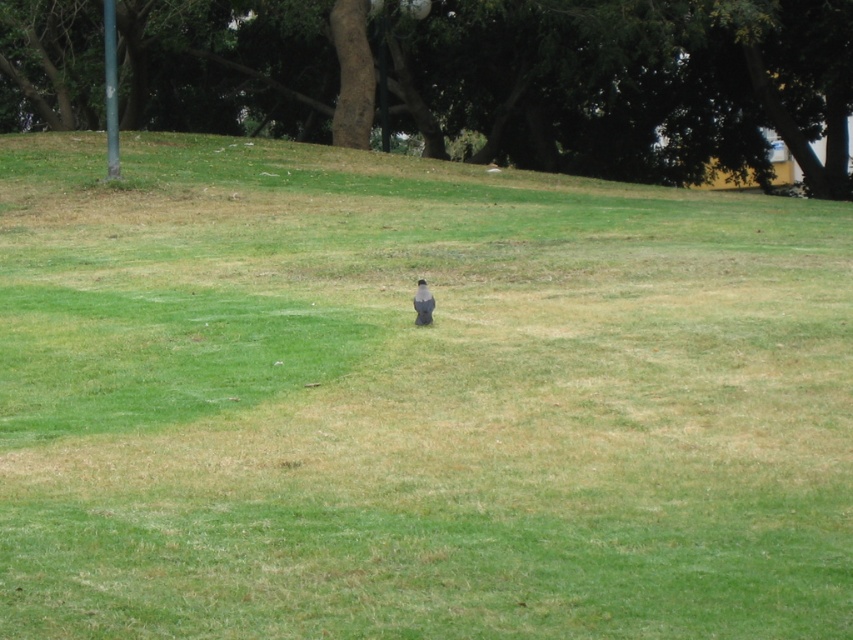
Can you confirm if brown textured tree at upper center is positioned to the right of gray matte bird at center?

No, brown textured tree at upper center is not to the right of gray matte bird at center.

Between point (647, 33) and point (431, 301), which one is positioned in front?

Positioned in front is point (431, 301).

What do you see at coordinates (461, 77) in the screenshot? This screenshot has width=853, height=640. I see `brown textured tree at upper center` at bounding box center [461, 77].

Where is `brown textured tree at upper center`? This screenshot has height=640, width=853. brown textured tree at upper center is located at coordinates [461, 77].